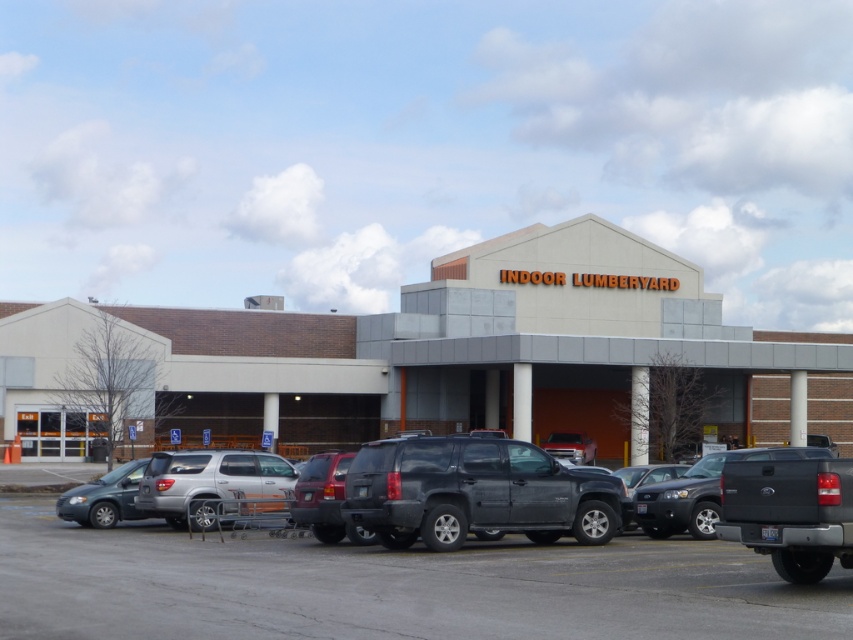
Is point (91, 509) positioned before point (643, 477)?

No.

Which is above, matte gray minivan at lower left or matte black sedan at center?

Positioned higher is matte gray minivan at lower left.

Does point (83, 484) come closer to viewer compared to point (664, 465)?

No, it is not.

The width and height of the screenshot is (853, 640). What are the coordinates of `matte gray minivan at lower left` in the screenshot? It's located at (103, 497).

Who is more forward, (363, 323) or (74, 488)?

Positioned in front is point (74, 488).

Is point (294, 324) closer to camera compared to point (74, 515)?

No, (294, 324) is further to viewer.

The height and width of the screenshot is (640, 853). I want to click on brick building at center, so click(x=448, y=356).

The image size is (853, 640). Describe the element at coordinates (448, 356) in the screenshot. I see `brick building at center` at that location.

Where is `brick building at center`? This screenshot has width=853, height=640. brick building at center is located at coordinates (448, 356).

The width and height of the screenshot is (853, 640). In order to click on brick building at center in this screenshot , I will do `click(448, 356)`.